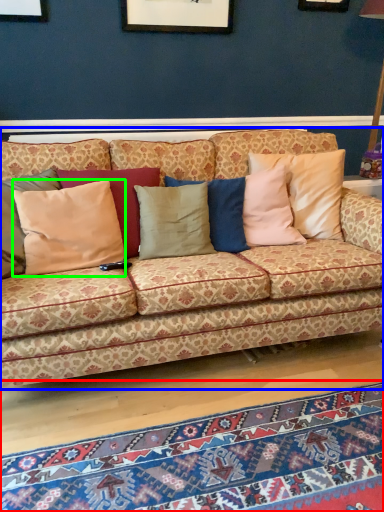
Question: Which is farther away from mat (highlighted by a red box)? studio couch (highlighted by a blue box) or pillow (highlighted by a green box)?

Choices:
 (A) studio couch
 (B) pillow

Answer: (B)